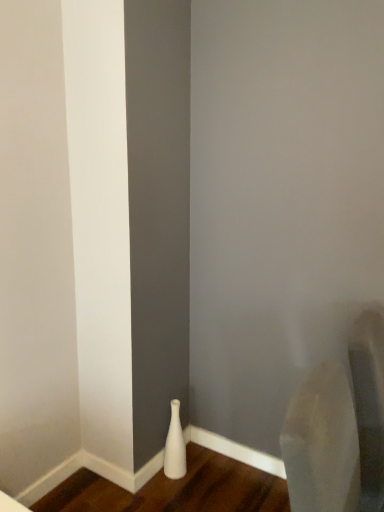
Question: Should I look upward or downward to see white glossy vase at lower left?

Choices:
 (A) up
 (B) down

Answer: (B)